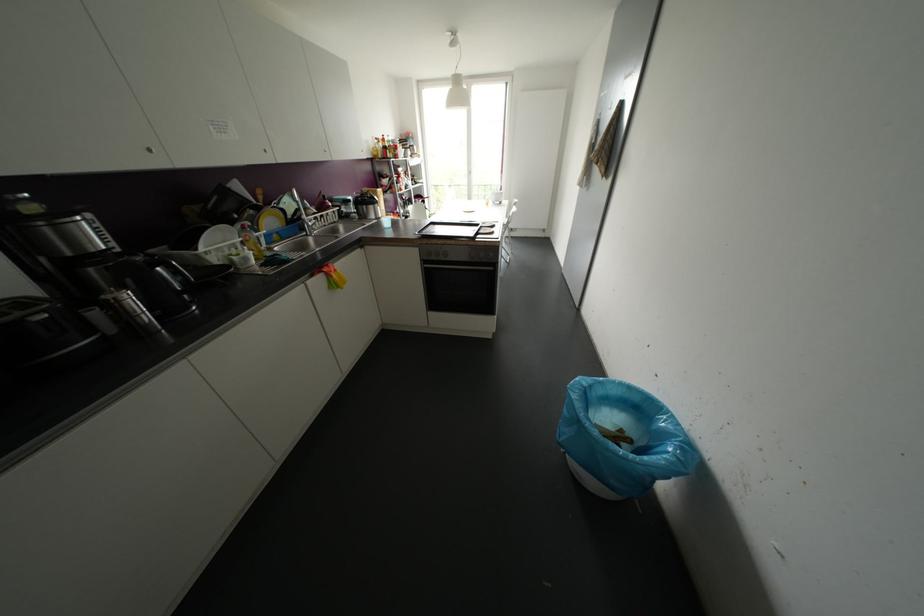
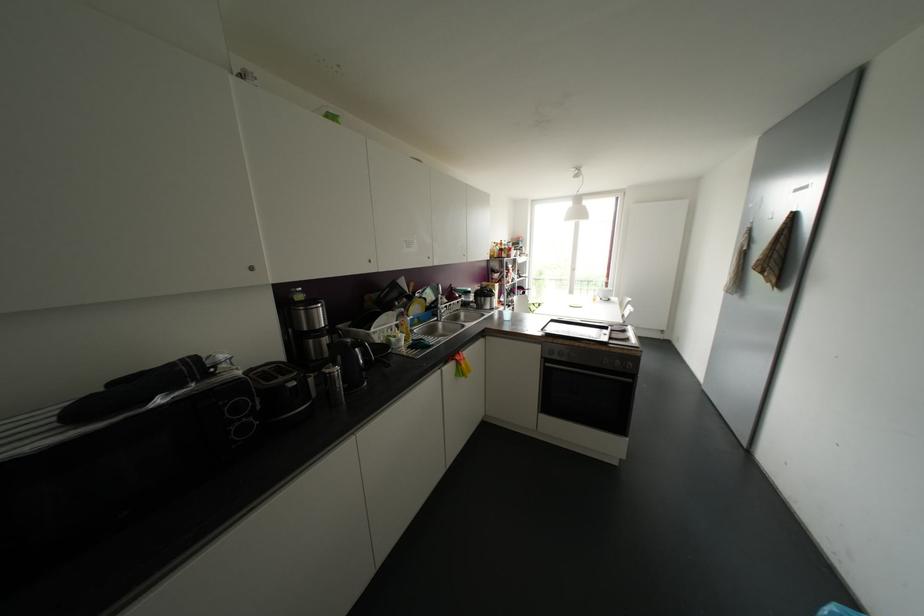
Locate, in the second image, the point that corresponds to point (426, 265) in the first image.

(546, 363)